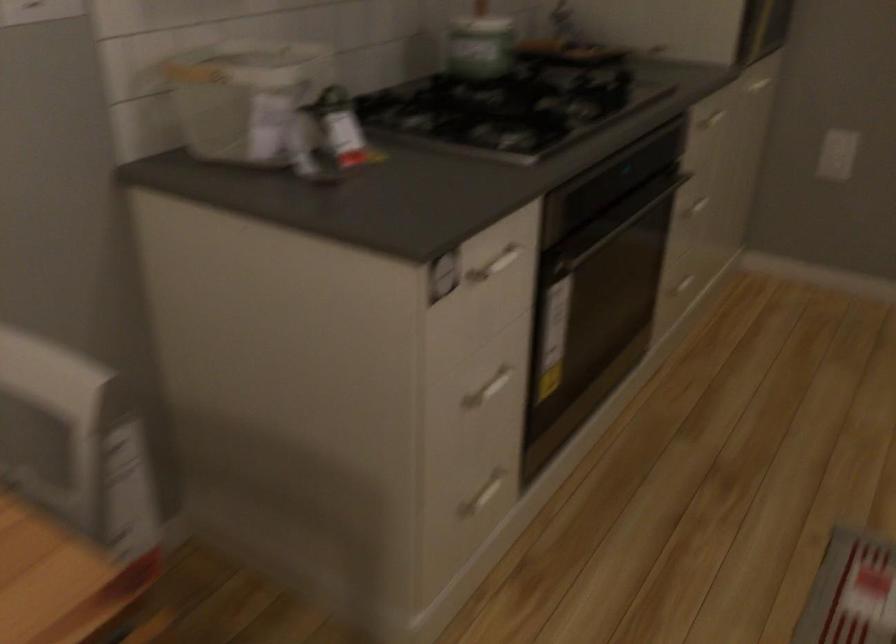
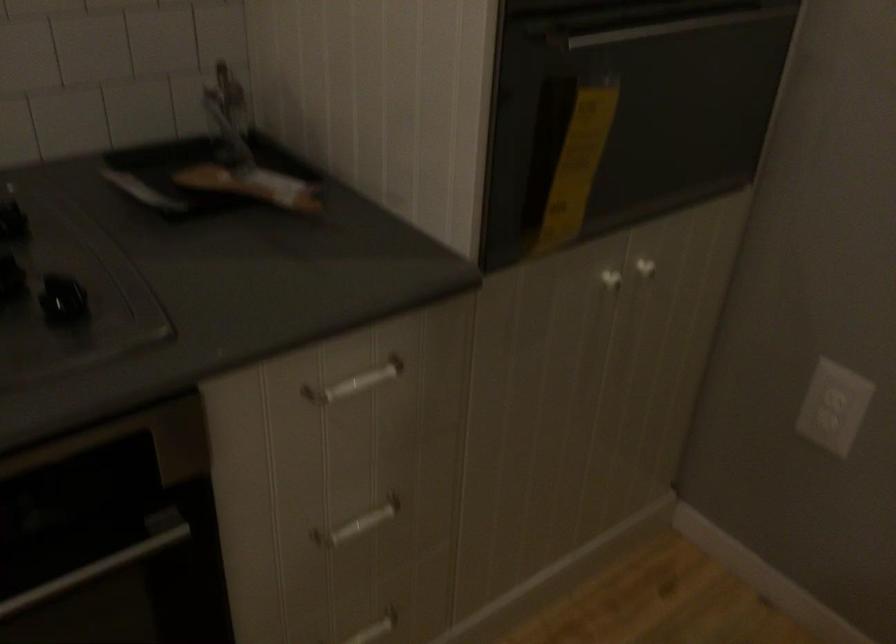
What movement of the cameraman would produce the second image?

The cameraman walked toward right, forward.